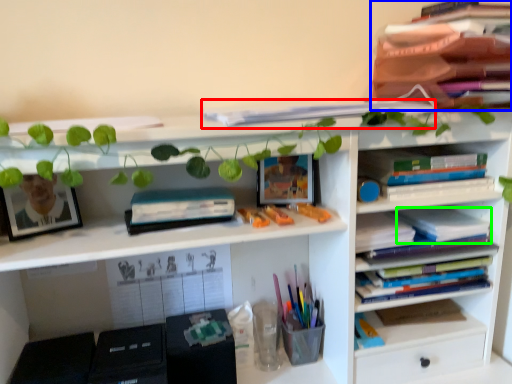
Question: Based on their relative distances, which object is farther from book (highlighted by a red box)? Choose from book (highlighted by a blue box) and book (highlighted by a green box).

Choices:
 (A) book
 (B) book

Answer: (B)